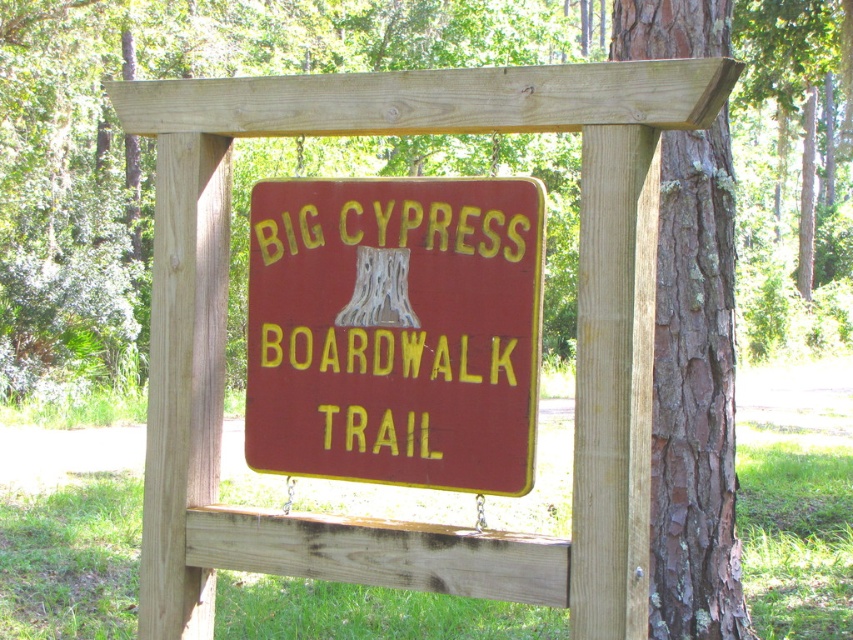
You are standing in front of the wooden signpost in the forest. There are two points marked on the signpost. The first point is at coordinates point (300,32) and the second is at point (387,396). If you were to walk straight towards the signpost, which point would you encounter first?

Point (300,32) is further to the viewer than point (387,396), so you would encounter point (300,32) first when walking towards the signpost.

You are standing at the origin point of the coordinate system. Which direction should you move to reach the brown rough bark tree at center?

The brown rough bark tree at center is located at coordinate point 0.220 in the x direction and 0.178 in the y direction. Therefore, you should move towards the positive x and positive y directions to reach it.